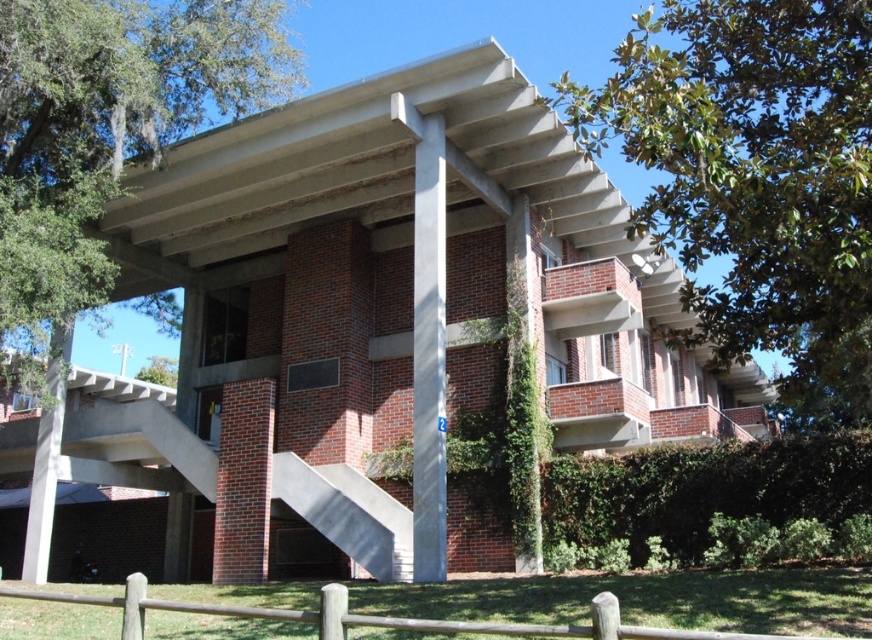
You are standing in front of the building and notice a point marked at coordinates (109, 122). What object is located at that point?

The point at coordinates (109, 122) corresponds to the green leafy tree at upper left.

You are an architect designing a new building and want to ensure that the green leafy tree at upper left and the white marble pillar at center are visually balanced. Given their sizes, which object should be placed farther away from the building to maintain balance?

The green leafy tree at upper left is smaller than the white marble pillar at center, so to maintain visual balance, the smaller green leafy tree at upper left should be placed farther away from the building compared to the larger white marble pillar at center.